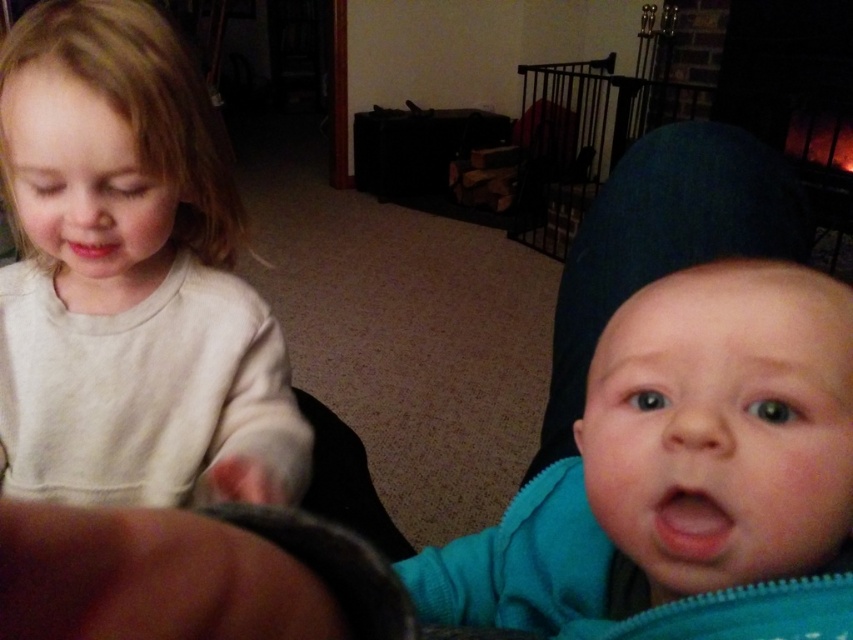
Question: Which of the following is the closest to the observer?

Choices:
 (A) (225, 387)
 (B) (703, 524)

Answer: (B)

Question: Can you confirm if light beige sweater at left is wider than teal zipper baby at center?

Choices:
 (A) no
 (B) yes

Answer: (B)

Question: Which point is farther to the camera?

Choices:
 (A) teal zipper baby at center
 (B) light beige sweater at left

Answer: (B)

Question: Is light beige sweater at left bigger than teal zipper baby at center?

Choices:
 (A) yes
 (B) no

Answer: (A)

Question: Can you confirm if light beige sweater at left is bigger than teal zipper baby at center?

Choices:
 (A) yes
 (B) no

Answer: (A)